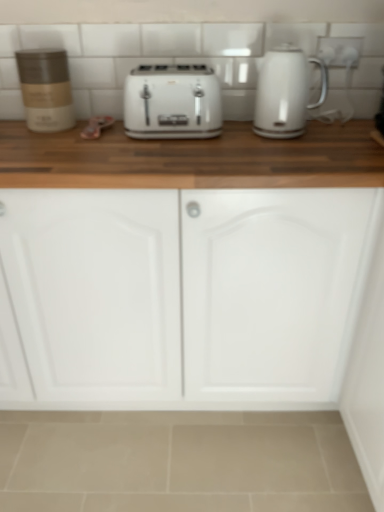
This screenshot has width=384, height=512. I want to click on free space to the left of white glossy toaster at center, so click(90, 139).